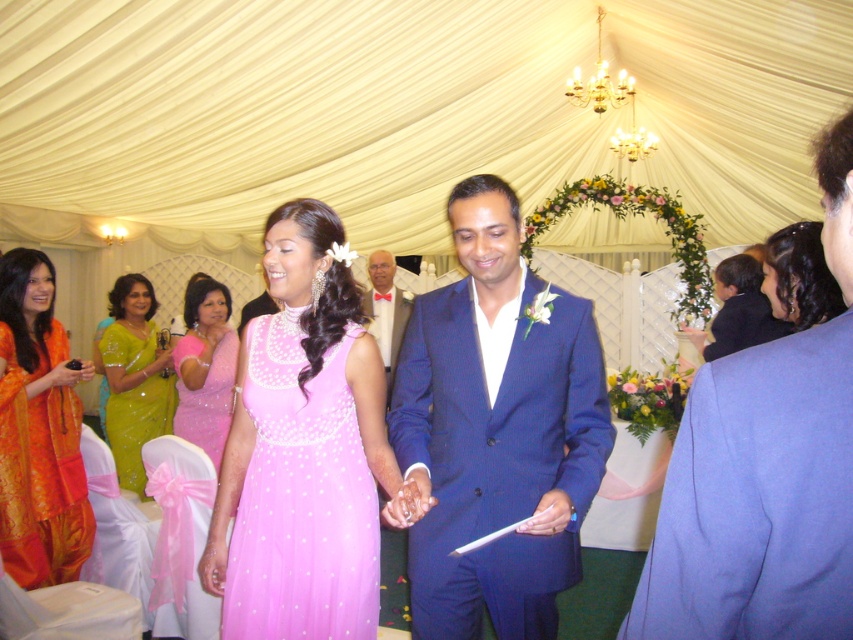
Question: Can you confirm if blue textured suit at right is wider than green sequined sari at left?

Choices:
 (A) no
 (B) yes

Answer: (A)

Question: Which object is positioned farthest from the matte tulle dress at center?

Choices:
 (A) blue wool suit at center
 (B) green sequined sari at left

Answer: (B)

Question: Is matte tulle dress at center positioned at the back of green sequined sari at left?

Choices:
 (A) no
 (B) yes

Answer: (A)

Question: Does blue wool suit at center come behind blue textured suit at right?

Choices:
 (A) no
 (B) yes

Answer: (B)

Question: Which is nearer to the matte bow tie at center?

Choices:
 (A) matte tulle dress at center
 (B) orange silk saree at left

Answer: (B)

Question: Which point appears closest to the camera in this image?

Choices:
 (A) (723, 339)
 (B) (105, 332)
 (C) (480, 468)
 (D) (799, 284)

Answer: (C)